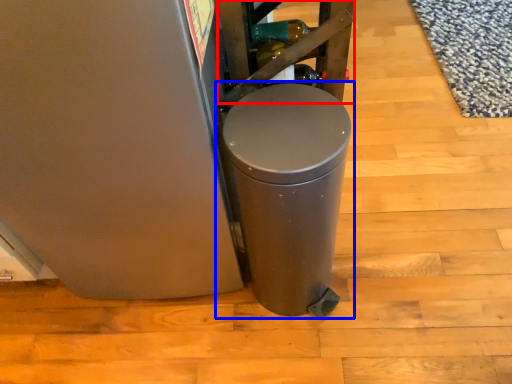
Question: Which object appears closest to the camera in this image, shelf (highlighted by a red box) or waste container (highlighted by a blue box)?

Choices:
 (A) shelf
 (B) waste container

Answer: (B)